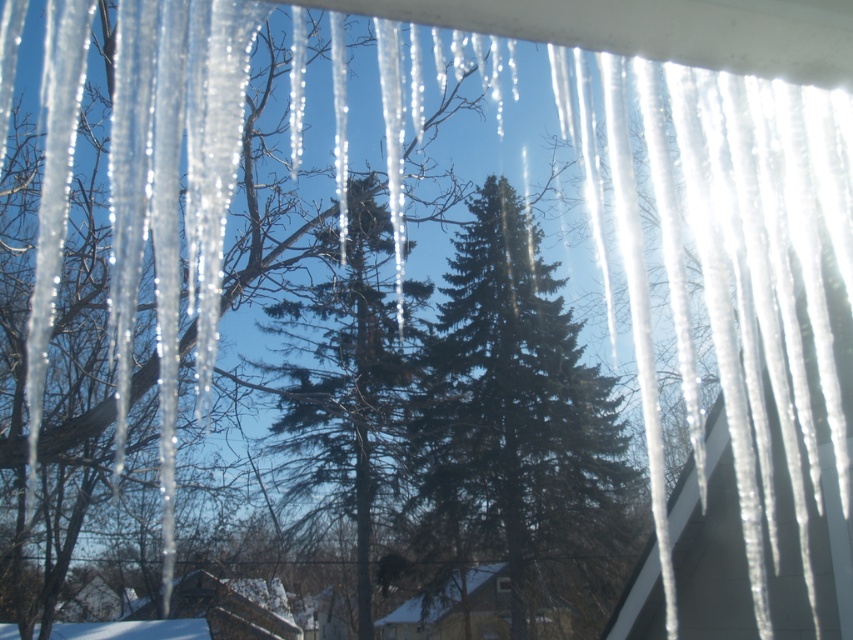
Is green matte evergreen tree at center wider than transparent glass window at center?

Correct, the width of green matte evergreen tree at center exceeds that of transparent glass window at center.

Identify the location of green matte evergreen tree at center. The width and height of the screenshot is (853, 640). (517, 432).

Where is `green matte evergreen tree at center`? green matte evergreen tree at center is located at coordinates [x=517, y=432].

Can you confirm if green matte evergreen tree at center is taller than green textured pine tree at center?

No, green matte evergreen tree at center is not taller than green textured pine tree at center.

Between green matte evergreen tree at center and green textured pine tree at center, which one is positioned lower?

green matte evergreen tree at center is below.

Which is behind, point (473, 257) or point (366, 266)?

The point (473, 257) is behind.

Image resolution: width=853 pixels, height=640 pixels. Find the location of `green matte evergreen tree at center`. green matte evergreen tree at center is located at coordinates (517, 432).

Which is below, green textured pine tree at center or transparent glass window at center?

transparent glass window at center is lower down.

Between point (381, 392) and point (500, 584), which one is positioned in front?

Point (381, 392) is more forward.

Which is behind, point (355, 392) or point (509, 582)?

Positioned behind is point (509, 582).

At what (x,y) coordinates should I click in order to perform the action: click on green textured pine tree at center. Please return your answer as a coordinate pair (x, y). This screenshot has width=853, height=640. Looking at the image, I should click on (347, 381).